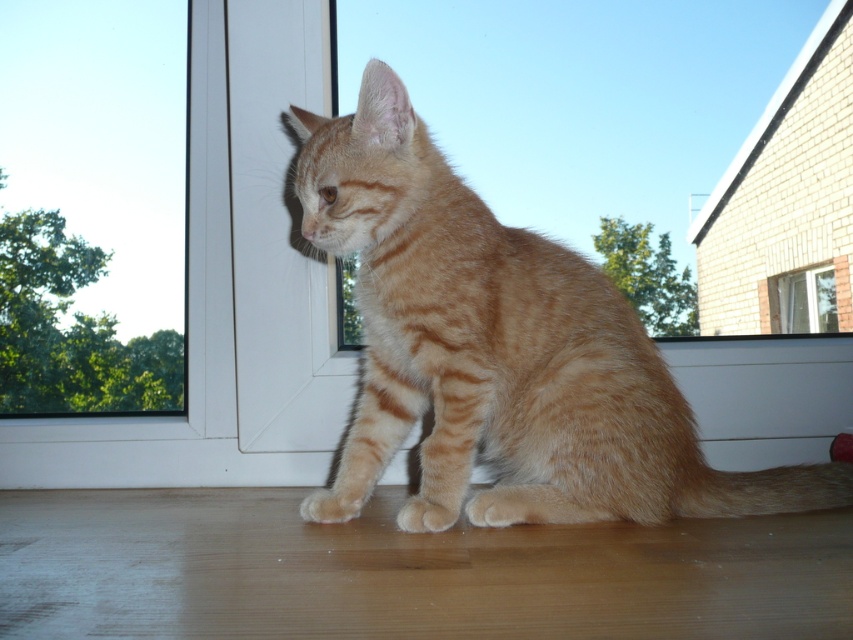
The width and height of the screenshot is (853, 640). What do you see at coordinates (498, 352) in the screenshot? I see `orange tabby cat at center` at bounding box center [498, 352].

Between orange tabby cat at center and transparent glass window at upper right, which one appears on the right side from the viewer's perspective?

transparent glass window at upper right

Image resolution: width=853 pixels, height=640 pixels. I want to click on orange tabby cat at center, so click(x=498, y=352).

Is the position of orange tabby cat at center more distant than that of transparent glass window at upper left?

No, orange tabby cat at center is closer to the viewer.

Describe the element at coordinates (498, 352) in the screenshot. I see `orange tabby cat at center` at that location.

This screenshot has width=853, height=640. In order to click on orange tabby cat at center in this screenshot , I will do `click(498, 352)`.

How much distance is there between transparent glass window at upper left and transparent glass window at upper right?

transparent glass window at upper left and transparent glass window at upper right are 3.67 feet apart.

Is transparent glass window at upper left behind transparent glass window at upper right?

No.

Which is behind, point (3, 48) or point (805, 300)?

The point (805, 300) is more distant.

At what (x,y) coordinates should I click in order to perform the action: click on transparent glass window at upper left. Please return your answer as a coordinate pair (x, y). Image resolution: width=853 pixels, height=640 pixels. Looking at the image, I should click on (91, 205).